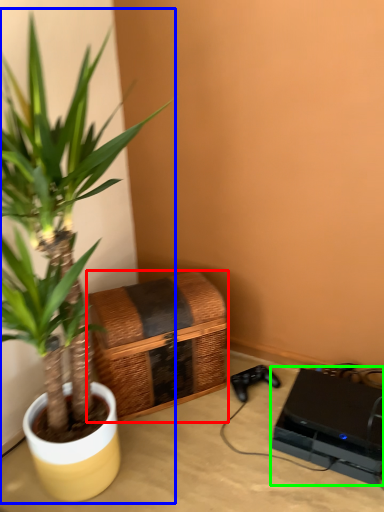
Question: Which is nearer to the basket (highlighted by a red box)? houseplant (highlighted by a blue box) or computer (highlighted by a green box).

Choices:
 (A) houseplant
 (B) computer

Answer: (A)